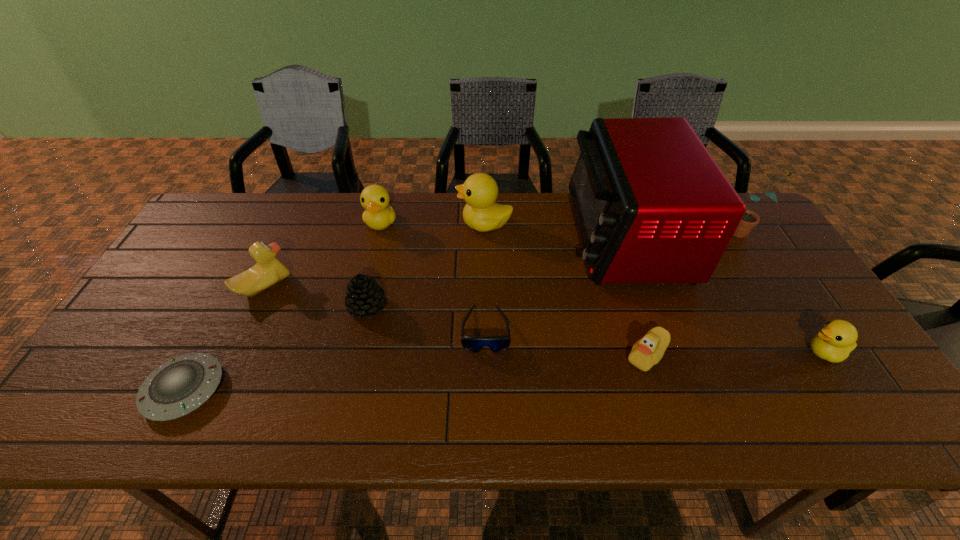
Image resolution: width=960 pixels, height=540 pixels. I want to click on vacant space situated 0.170m on the face of the rightmost yellow duck, so click(733, 353).

Where is `free spot located 0.140m on the face of the rightmost yellow duck`? The width and height of the screenshot is (960, 540). free spot located 0.140m on the face of the rightmost yellow duck is located at coordinates (746, 353).

At what (x,y) coordinates should I click in order to perform the action: click on blank space located at the beak of the right beige duck. Please return your answer as a coordinate pair (x, y). Looking at the image, I should click on (546, 356).

You are a GUI agent. You are given a task and a screenshot of the screen. Output one action in this format:
    pyautogui.click(x=<x>, y=<y>)
    Task: Click on the vacant space located 0.200m at the beak of the right beige duck
    The width and height of the screenshot is (960, 540).
    Given the screenshot: What is the action you would take?
    pyautogui.click(x=542, y=356)

At what (x,y) coordinates should I click in order to perform the action: click on vacant position located at the beak of the right beige duck. Please return your answer as a coordinate pair (x, y). The width and height of the screenshot is (960, 540). Looking at the image, I should click on (485, 356).

Find the location of a particular element. Image resolution: width=960 pixels, height=540 pixels. vacant region located 0.180m on the front-facing side of the sunglasses is located at coordinates (487, 427).

At what (x,y) coordinates should I click in order to perform the action: click on blank area located 0.220m on the right of the shortest object. Please return your answer as a coordinate pair (x, y). Looking at the image, I should click on (319, 389).

Locate an element on the screen. The height and width of the screenshot is (540, 960). toaster oven positioned at the far edge is located at coordinates (652, 206).

You are a GUI agent. You are given a task and a screenshot of the screen. Output one action in this format:
    pyautogui.click(x=<x>, y=<y>)
    Task: Click on the sunflower that is at the far edge
    
    Given the screenshot: What is the action you would take?
    pyautogui.click(x=750, y=219)

The image size is (960, 540). I want to click on object positioned at the near edge, so click(179, 386).